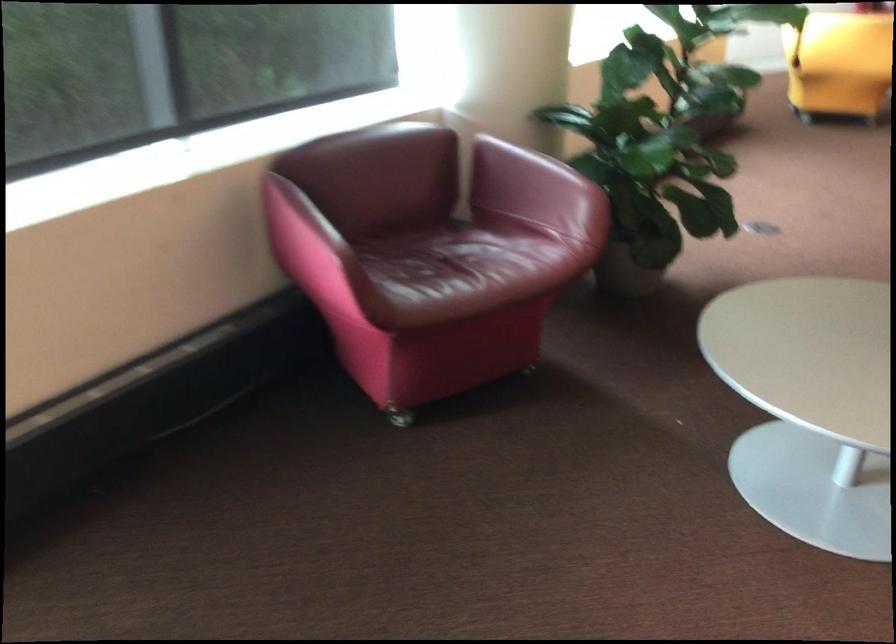
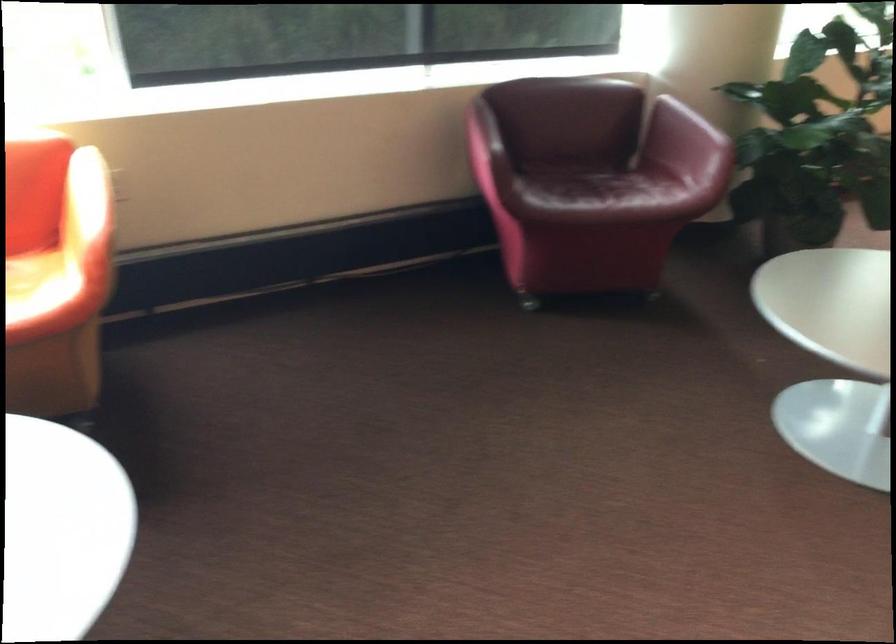
In the second image, find the point that corresponds to the point at 332,245 in the first image.

(483, 140)